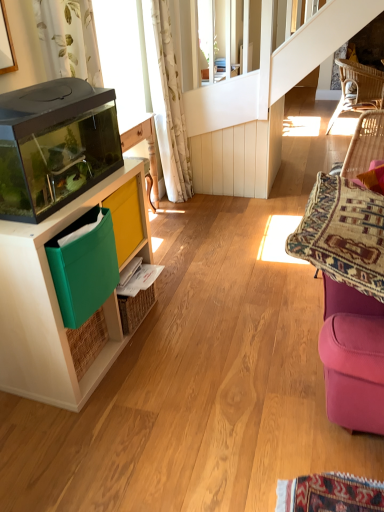
Locate an element on the screen. vacant area that is in front of matte wood cabinet at left is located at coordinates (100, 433).